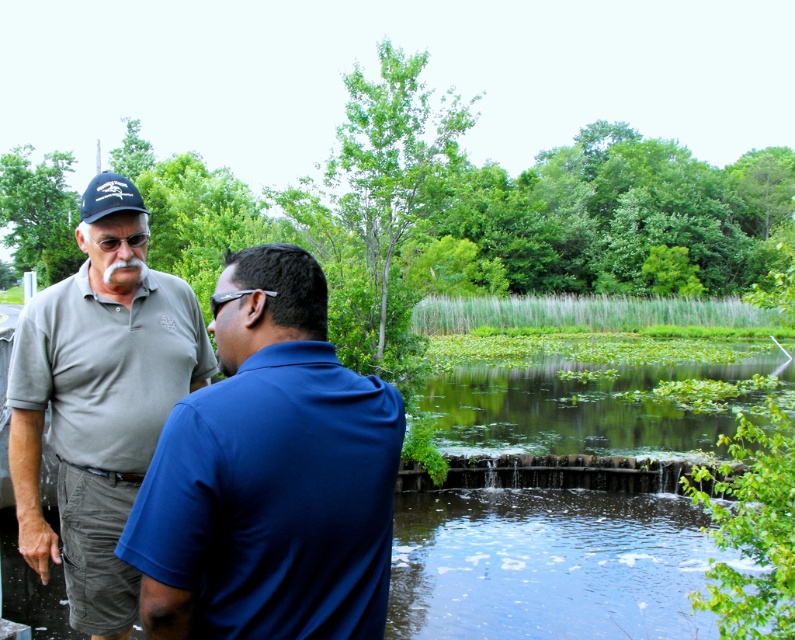
Question: Which object is closer to the camera taking this photo?

Choices:
 (A) gray cotton polo shirt at left
 (B) matte black baseball cap at upper left

Answer: (A)

Question: Does gray cotton polo shirt at left appear on the right side of green leafy vegetation at lower center?

Choices:
 (A) yes
 (B) no

Answer: (B)

Question: Can you confirm if gray cotton polo shirt at left is positioned to the left of green leafy vegetation at lower center?

Choices:
 (A) yes
 (B) no

Answer: (A)

Question: Estimate the real-world distances between objects in this image. Which object is closer to the green leafy vegetation at lower center?

Choices:
 (A) matte gray polo shirt at center
 (B) matte black baseball cap at upper left
 (C) gray cotton polo shirt at left

Answer: (A)

Question: Is gray cotton polo shirt at left below matte black baseball cap at upper left?

Choices:
 (A) yes
 (B) no

Answer: (A)

Question: Which point is closer to the camera taking this photo?

Choices:
 (A) (617, 371)
 (B) (115, 596)
 (C) (91, 209)
 (D) (342, 465)

Answer: (D)